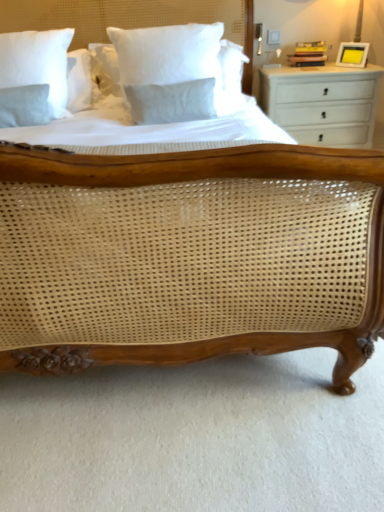
Question: Is white cotton pillow at upper left, acting as the first pillow starting from the back, oriented towards yellow matte picture frame at upper right?

Choices:
 (A) yes
 (B) no

Answer: (B)

Question: Is white cotton pillow at upper left, acting as the first pillow starting from the left, taller than yellow matte picture frame at upper right?

Choices:
 (A) no
 (B) yes

Answer: (B)

Question: From a real-world perspective, is white cotton pillow at upper left, the second pillow in the right-to-left sequence, positioned under yellow matte picture frame at upper right based on gravity?

Choices:
 (A) no
 (B) yes

Answer: (A)

Question: Considering the relative positions of white cotton pillow at upper left, acting as the first pillow starting from the back, and yellow matte picture frame at upper right in the image provided, is white cotton pillow at upper left, acting as the first pillow starting from the back, to the right of yellow matte picture frame at upper right from the viewer's perspective?

Choices:
 (A) no
 (B) yes

Answer: (A)

Question: Is white cotton pillow at upper left, which ranks as the 2th pillow in front-to-back order, positioned before yellow matte picture frame at upper right?

Choices:
 (A) yes
 (B) no

Answer: (A)

Question: Considering the positions of white cotton pillow at upper center, the first pillow when ordered from front to back, and yellow matte picture frame at upper right in the image, is white cotton pillow at upper center, the first pillow when ordered from front to back, wider or thinner than yellow matte picture frame at upper right?

Choices:
 (A) wide
 (B) thin

Answer: (A)

Question: From the image's perspective, is white cotton pillow at upper center, arranged as the 2th pillow when viewed from the left, above or below yellow matte picture frame at upper right?

Choices:
 (A) above
 (B) below

Answer: (B)

Question: Considering their positions, is white cotton pillow at upper center, arranged as the 2th pillow when viewed from the left, located in front of or behind yellow matte picture frame at upper right?

Choices:
 (A) front
 (B) behind

Answer: (A)

Question: Visually, is white cotton pillow at upper center, acting as the first pillow starting from the right, positioned to the left or to the right of yellow matte picture frame at upper right?

Choices:
 (A) right
 (B) left

Answer: (B)

Question: In terms of height, does white painted wood chest of drawers at right look taller or shorter compared to yellow matte picture frame at upper right?

Choices:
 (A) short
 (B) tall

Answer: (B)

Question: Relative to yellow matte picture frame at upper right, is white painted wood chest of drawers at right in front or behind?

Choices:
 (A) behind
 (B) front

Answer: (A)

Question: Based on their sizes in the image, would you say white painted wood chest of drawers at right is bigger or smaller than yellow matte picture frame at upper right?

Choices:
 (A) big
 (B) small

Answer: (A)

Question: From a real-world perspective, relative to yellow matte picture frame at upper right, is white painted wood chest of drawers at right vertically above or below?

Choices:
 (A) above
 (B) below

Answer: (B)

Question: Is white cotton pillow at upper center, arranged as the 2th pillow when viewed from the left, taller or shorter than white painted wood chest of drawers at right?

Choices:
 (A) tall
 (B) short

Answer: (B)

Question: Would you say white cotton pillow at upper center, acting as the first pillow starting from the right, is inside or outside white painted wood chest of drawers at right?

Choices:
 (A) inside
 (B) outside

Answer: (B)